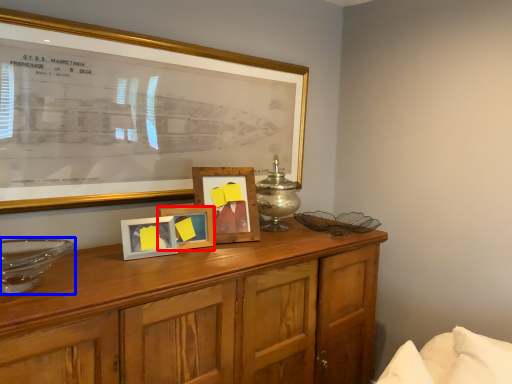
Question: Which point is closer to the camera, picture frame (highlighted by a red box) or glass bowl (highlighted by a blue box)?

Choices:
 (A) picture frame
 (B) glass bowl

Answer: (B)